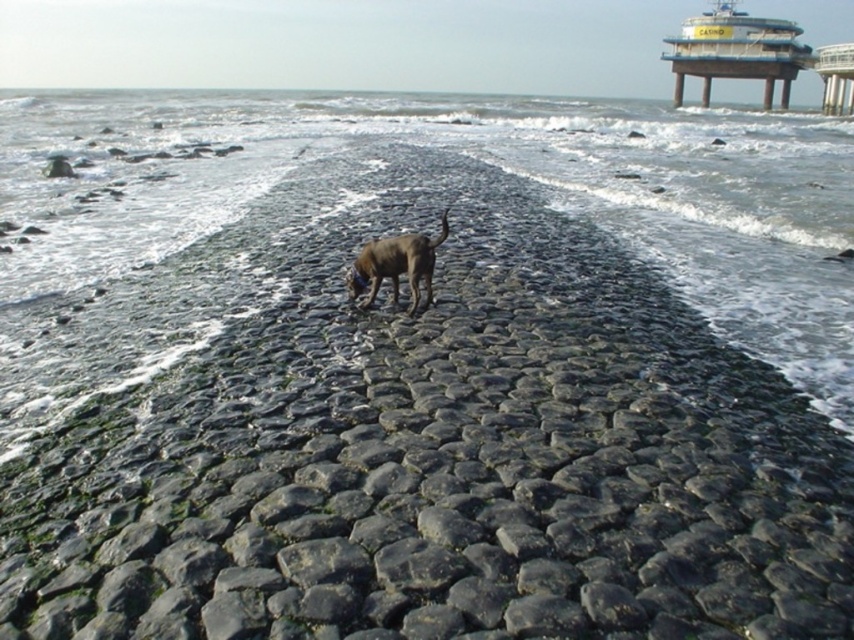
Question: Which point appears closest to the camera in this image?

Choices:
 (A) (822, 52)
 (B) (401, 237)

Answer: (B)

Question: Which object appears farthest from the camera in this image?

Choices:
 (A) metallic blue dock at upper right
 (B) clear water at center
 (C) brown matte dog at center

Answer: (A)

Question: Does clear water at center have a smaller size compared to metallic gray pier at upper right?

Choices:
 (A) yes
 (B) no

Answer: (B)

Question: Which object appears farthest from the camera in this image?

Choices:
 (A) brown matte dog at center
 (B) metallic blue dock at upper right
 (C) clear water at center
 (D) metallic gray pier at upper right

Answer: (B)

Question: Does clear water at center appear over metallic gray pier at upper right?

Choices:
 (A) yes
 (B) no

Answer: (B)

Question: In this image, where is brown matte dog at center located relative to metallic gray pier at upper right?

Choices:
 (A) above
 (B) below

Answer: (B)